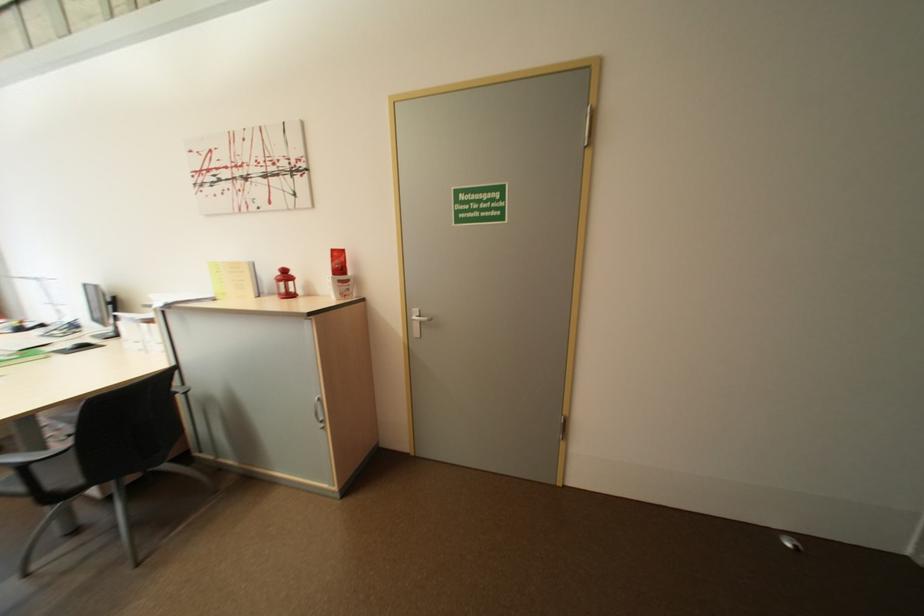
This screenshot has width=924, height=616. What do you see at coordinates (35, 451) in the screenshot?
I see `a chair armrest` at bounding box center [35, 451].